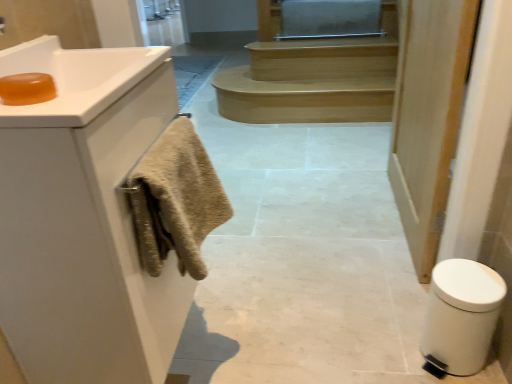
Question: In terms of width, does translucent amber soap at upper left look wider or thinner when compared to white plastic bidet at lower right?

Choices:
 (A) thin
 (B) wide

Answer: (A)

Question: In terms of height, does translucent amber soap at upper left look taller or shorter compared to white plastic bidet at lower right?

Choices:
 (A) short
 (B) tall

Answer: (A)

Question: Which object is the closest to the white matte cabinet at left?

Choices:
 (A) beige textured towel at left
 (B) light brown wood stairs at center
 (C) translucent amber soap at upper left
 (D) white matte door at right
 (E) white plastic bidet at lower right

Answer: (A)

Question: Based on their relative distances, which object is farther from the white matte cabinet at left?

Choices:
 (A) beige textured towel at left
 (B) white matte door at right
 (C) light brown wood stairs at center
 (D) white plastic bidet at lower right
 (E) translucent amber soap at upper left

Answer: (C)